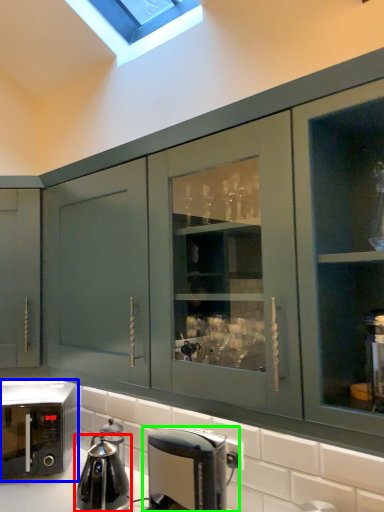
Question: Considering the real-world distances, which object is closest to kitchen appliance (highlighted by a red box)? home appliance (highlighted by a blue box) or coffee maker (highlighted by a green box).

Choices:
 (A) home appliance
 (B) coffee maker

Answer: (A)